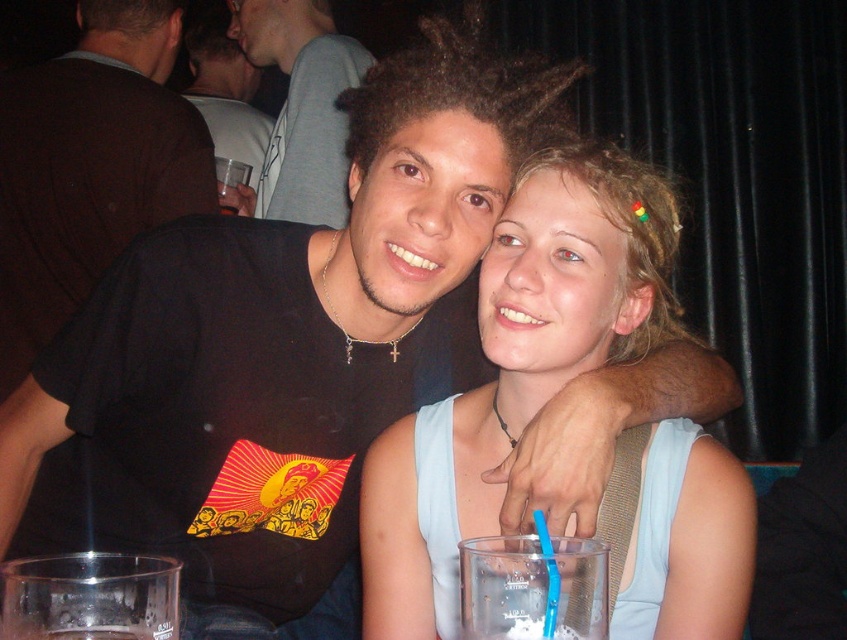
You are taking a photo of the two glasses in the foreground. Which point, point (x=137, y=33) or point (x=257, y=172), is closer to the camera?

Point (x=137, y=33) is closer to the camera than point (x=257, y=172).